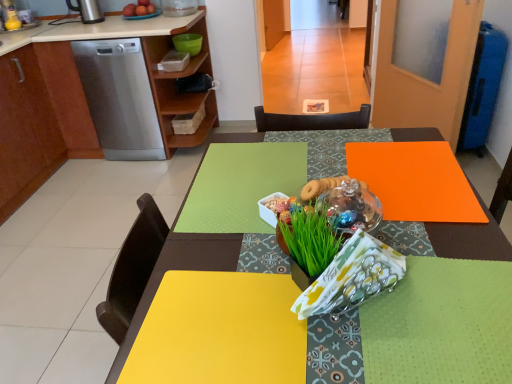
Identify the location of free point behind translucent glass donuts at center. (329, 162).